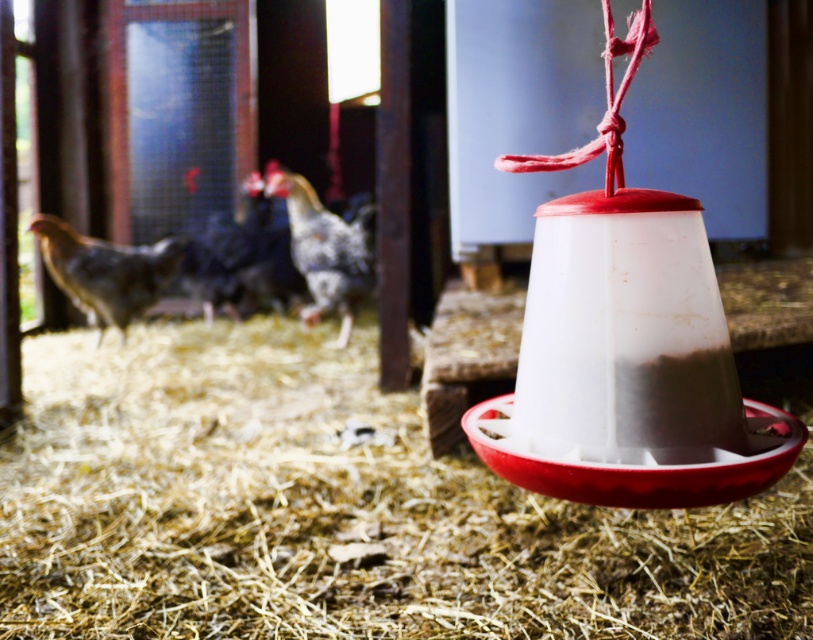
You are a farmer checking the coop and notice the blue speckled feathers at center and the speckled feathered chicken at center. Which object is located to the left of the other?

The blue speckled feathers at center is positioned on the left side of speckled feathered chicken at center.

You are standing inside the chicken coop and want to locate two specific points marked in the image. The first point is at coordinates point (122, 387) and the second is at point (203, 260). Which of these points is nearer to your current position?

Point (122, 387) is closer to the camera than point (203, 260), so the first point is nearer to your current position.

You are a farmer checking the coop. You see the brown straw at center and the blue speckled feathers at center. Which object is wider?

The brown straw at center is wider than the blue speckled feathers at center.